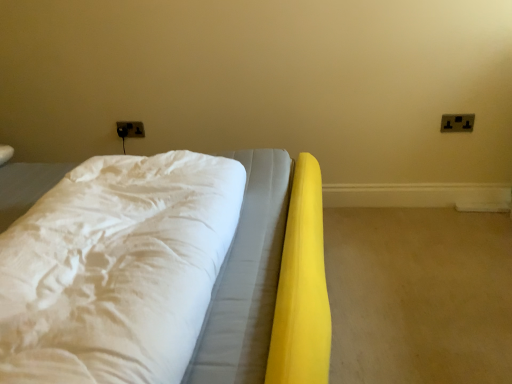
Question: Considering the relative sizes of white fabric bed at center and black plastic electrical outlet at upper left, which is counted as the first electric outlet, starting from the left, in the image provided, is white fabric bed at center wider than black plastic electrical outlet at upper left, which is counted as the first electric outlet, starting from the left,?

Choices:
 (A) yes
 (B) no

Answer: (A)

Question: From the image's perspective, is white fabric bed at center above black plastic electrical outlet at upper left, arranged as the second electric outlet when viewed from the right?

Choices:
 (A) yes
 (B) no

Answer: (B)

Question: Considering the relative positions of white fabric bed at center and black plastic electrical outlet at upper left, acting as the second electric outlet starting from the front, in the image provided, is white fabric bed at center to the left of black plastic electrical outlet at upper left, acting as the second electric outlet starting from the front, from the viewer's perspective?

Choices:
 (A) no
 (B) yes

Answer: (A)

Question: Does white fabric bed at center turn towards black plastic electrical outlet at upper left, which is the first electric outlet in back-to-front order?

Choices:
 (A) yes
 (B) no

Answer: (B)

Question: Is white fabric bed at center touching black plastic electrical outlet at upper left, which is the first electric outlet in back-to-front order?

Choices:
 (A) yes
 (B) no

Answer: (B)

Question: From the image's perspective, is white fabric bed at center beneath black plastic electrical outlet at upper left, arranged as the second electric outlet when viewed from the right?

Choices:
 (A) yes
 (B) no

Answer: (A)

Question: Can you confirm if white fabric bed at center is wider than black plastic electric outlet at upper right, arranged as the 2th electric outlet when viewed from the back?

Choices:
 (A) no
 (B) yes

Answer: (B)

Question: Does white fabric bed at center have a greater height compared to black plastic electric outlet at upper right, marked as the 1th electric outlet in a right-to-left arrangement?

Choices:
 (A) yes
 (B) no

Answer: (A)

Question: From the image's perspective, does white fabric bed at center appear higher than black plastic electric outlet at upper right, placed as the first electric outlet when sorted from front to back?

Choices:
 (A) no
 (B) yes

Answer: (A)

Question: Are white fabric bed at center and black plastic electric outlet at upper right, placed as the 2th electric outlet when sorted from left to right, making contact?

Choices:
 (A) yes
 (B) no

Answer: (B)

Question: Does white fabric bed at center appear on the left side of black plastic electric outlet at upper right, placed as the 2th electric outlet when sorted from left to right?

Choices:
 (A) no
 (B) yes

Answer: (B)

Question: From a real-world perspective, does white fabric bed at center sit lower than black plastic electric outlet at upper right, placed as the 2th electric outlet when sorted from left to right?

Choices:
 (A) no
 (B) yes

Answer: (A)

Question: Can black plastic electrical outlet at upper left, which is counted as the first electric outlet, starting from the left, be found inside black plastic electric outlet at upper right, placed as the 2th electric outlet when sorted from left to right?

Choices:
 (A) no
 (B) yes

Answer: (A)